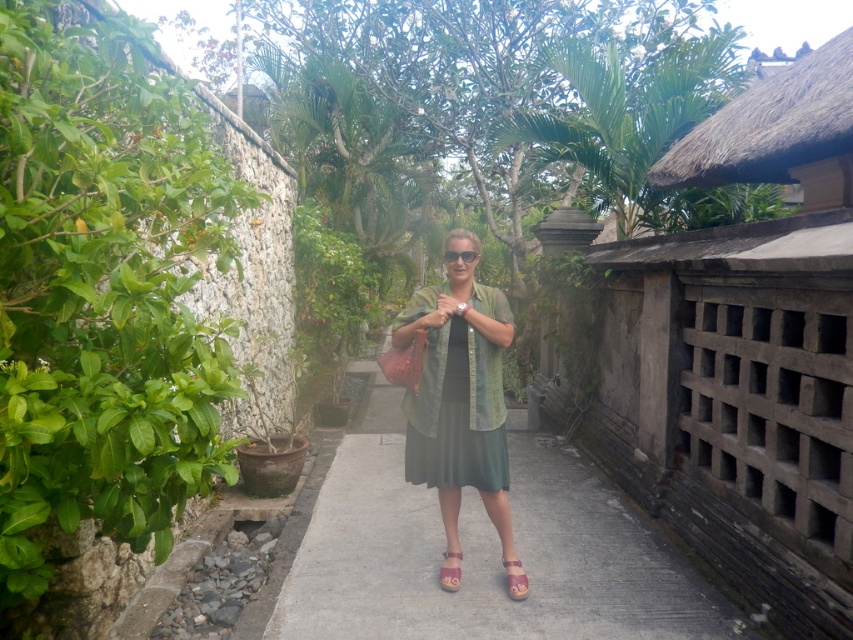
You are taking a photo of the scene and want to focus on both point [444,436] and point [451,566]. Which point should you adjust your focus to first to ensure both are in sharp view?

Point [444,436] should be focused on first because it is closer to the camera than point [451,566]. By focusing on the closer point, the farther point will also be within the depth of field if the aperture is set appropriately.

Based on the scene description, what is located at the coordinates point (485,554)?

The gray concrete pavement at center is located at point (485,554).

You are a fashion designer observing the person in the tropical setting. You need to determine which item, the pink fabric sandal at center or the matte black sunglasses at center, would require more space when packaging them separately. Which one needs a wider packaging box?

The pink fabric sandal at center has a lesser width compared to matte black sunglasses at center, so the matte black sunglasses at center would need a wider packaging box.